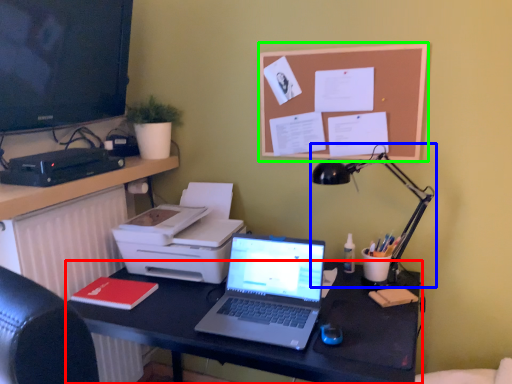
Question: Which object is positioned closest to desk (highlighted by a red box)? Select from lamp (highlighted by a blue box) and bulletin board (highlighted by a green box).

Choices:
 (A) lamp
 (B) bulletin board

Answer: (A)